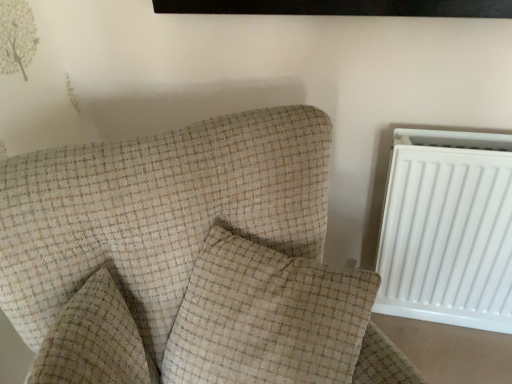
Question: Is beige checkered pillow at center, which is counted as the first pillow, starting from the left, positioned beyond the bounds of white plastic radiator at right?

Choices:
 (A) no
 (B) yes

Answer: (B)

Question: Does beige checkered pillow at center, acting as the 2th pillow starting from the right, appear on the left side of white plastic radiator at right?

Choices:
 (A) yes
 (B) no

Answer: (A)

Question: Is beige checkered pillow at center, acting as the 2th pillow starting from the right, wider than white plastic radiator at right?

Choices:
 (A) no
 (B) yes

Answer: (B)

Question: Can you confirm if beige checkered pillow at center, acting as the 2th pillow starting from the right, is thinner than white plastic radiator at right?

Choices:
 (A) yes
 (B) no

Answer: (B)

Question: Considering the relative sizes of beige checkered pillow at center, acting as the 2th pillow starting from the right, and white plastic radiator at right in the image provided, is beige checkered pillow at center, acting as the 2th pillow starting from the right, smaller than white plastic radiator at right?

Choices:
 (A) no
 (B) yes

Answer: (B)

Question: Is beige checkered pillow at center, acting as the 2th pillow starting from the right, shorter than white plastic radiator at right?

Choices:
 (A) yes
 (B) no

Answer: (A)

Question: Is white plastic radiator at right positioned in front of beige checkered armchair at center-left?

Choices:
 (A) no
 (B) yes

Answer: (A)

Question: From a real-world perspective, is white plastic radiator at right beneath beige checkered armchair at center-left?

Choices:
 (A) yes
 (B) no

Answer: (A)

Question: Is beige checkered armchair at center-left at the back of white plastic radiator at right?

Choices:
 (A) no
 (B) yes

Answer: (A)

Question: From the image's perspective, would you say white plastic radiator at right is positioned over beige checkered armchair at center-left?

Choices:
 (A) yes
 (B) no

Answer: (A)

Question: Can we say white plastic radiator at right lies outside beige checkered armchair at center-left?

Choices:
 (A) yes
 (B) no

Answer: (A)

Question: Considering the relative sizes of white plastic radiator at right and beige checkered armchair at center-left in the image provided, is white plastic radiator at right shorter than beige checkered armchair at center-left?

Choices:
 (A) yes
 (B) no

Answer: (A)

Question: Can beige textured pillow at center, which appears as the 1th pillow when viewed from the right, be found inside white plastic radiator at right?

Choices:
 (A) yes
 (B) no

Answer: (B)